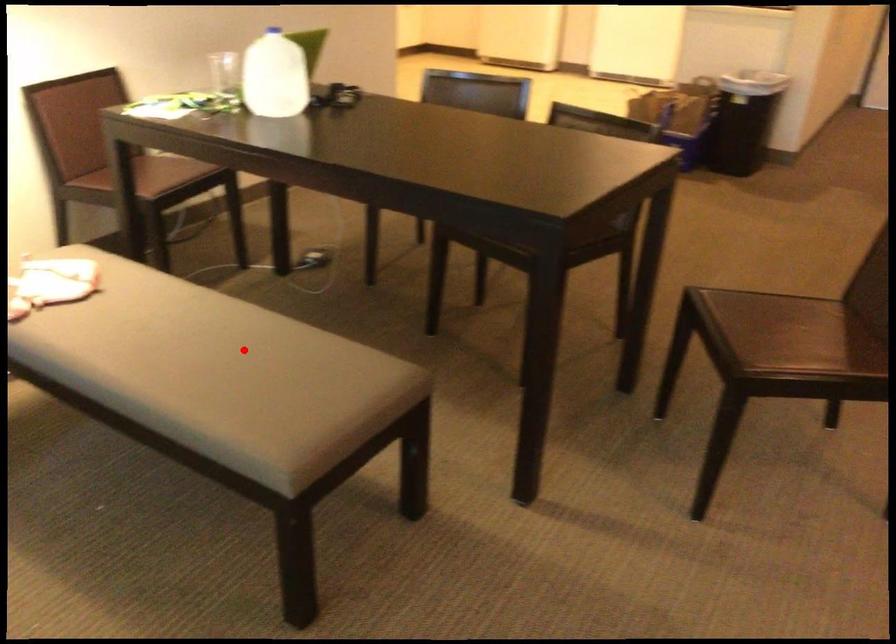
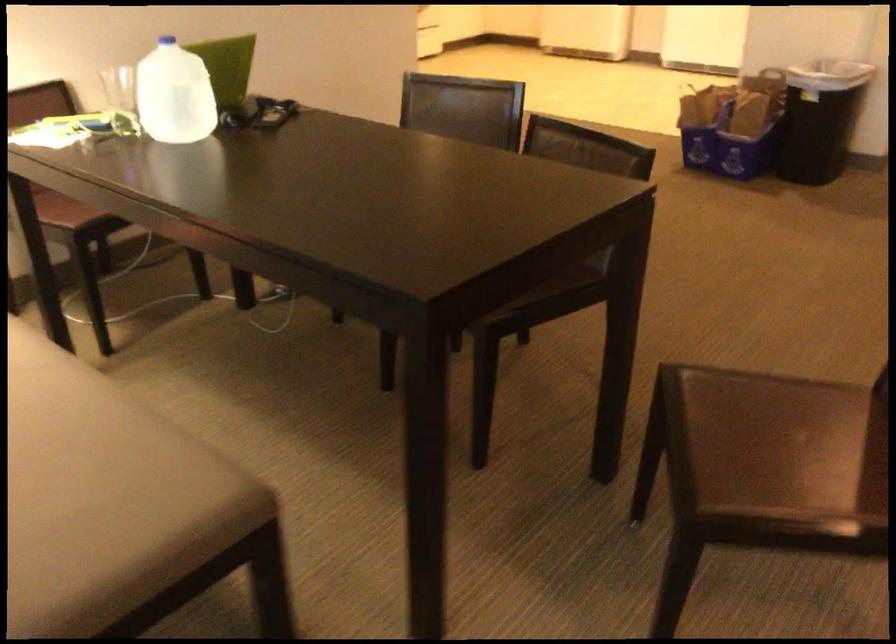
Question: I am providing you with two images of the same scene from different viewpoints. Image1 has a red point marked. In image2, the corresponding 3D location appears at what relative position? Reply with the corresponding letter.

Choices:
 (A) Closer
 (B) Farther

Answer: (A)